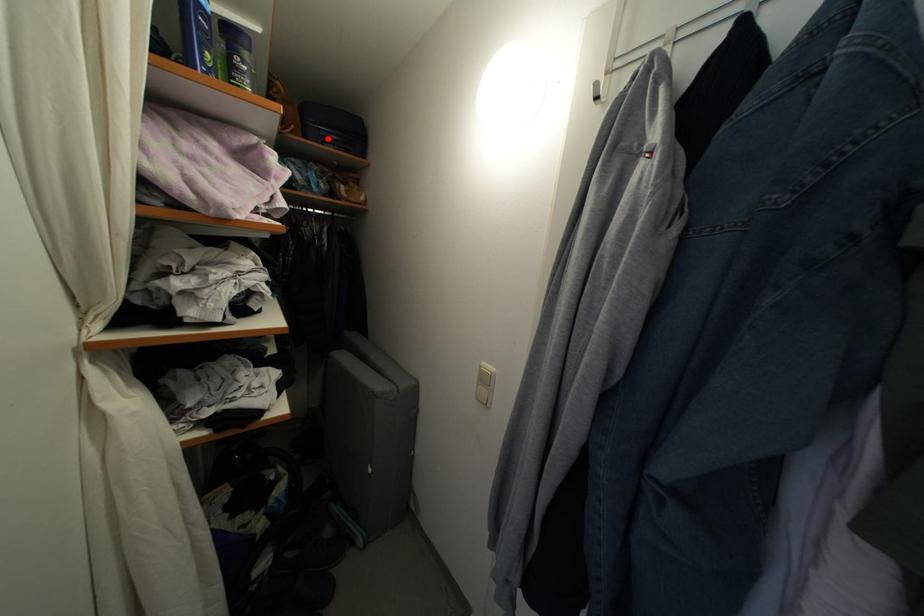
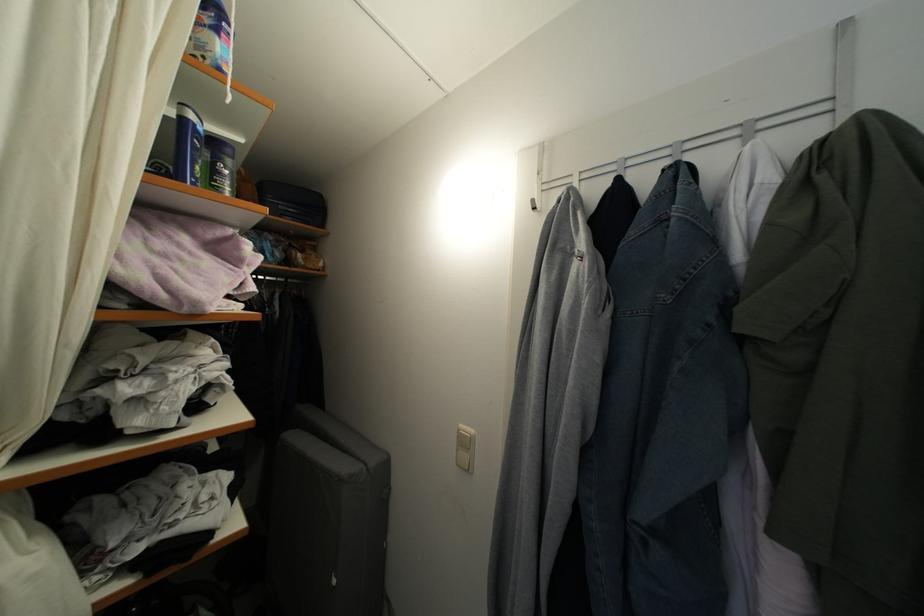
Find the pixel in the second image that matches the highlighted location in the first image.

(286, 214)